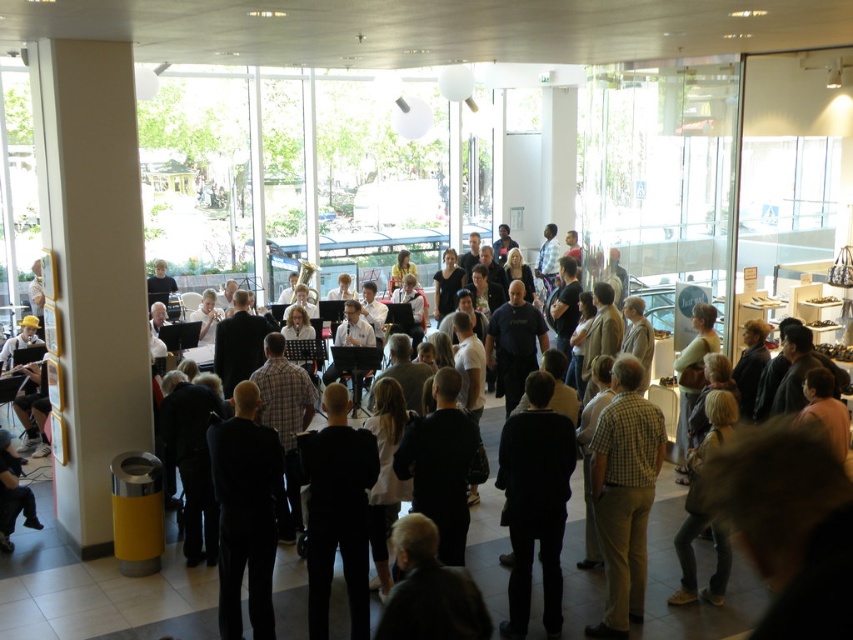
You are a photographer at the event and need to capture a photo that includes both the black suit at center and the dark gray suit at lower left. Based on their positions, which direction should you move to frame both subjects in the shot?

You should move to the left to frame both the black suit at center and the dark gray suit at lower left, as the black suit at center is to the right of the dark gray suit at lower left.

You are a photographer standing at the back of the room. You want to take a photo that includes both the checkered shirt at center and the black suit at center. The camera you are using has a maximum focus range of 2.5 meters. Will both subjects be in focus?

The checkered shirt at center and black suit at center are 2.56 meters apart from each other. Since the distance between them exceeds the camera maximum focus range of 2.5 meters, it is possible that one of the subjects may be out of focus. To ensure both are in focus, you might need to adjust your position or use a different camera setting.

You are a photographer positioned at the back of the room. You want to capture a photo of both the checkered shirt at center and the black suit at center without any obstruction. Based on their heights, which person should you position closer to the front to ensure both are visible?

The checkered shirt at center is much taller than the black suit at center. To ensure both are visible in the photo, the shorter black suit at center should be positioned closer to the front so that the taller checkered shirt at center doesn